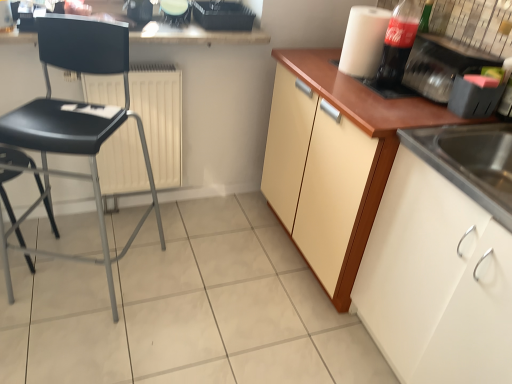
Question: Is smooth white countertop at upper center with white matte radiator at center?

Choices:
 (A) no
 (B) yes

Answer: (A)

Question: Would you consider smooth white countertop at upper center to be distant from white matte radiator at center?

Choices:
 (A) no
 (B) yes

Answer: (A)

Question: Is smooth white countertop at upper center looking in the opposite direction of white matte radiator at center?

Choices:
 (A) yes
 (B) no

Answer: (B)

Question: Does smooth white countertop at upper center contain white matte radiator at center?

Choices:
 (A) no
 (B) yes

Answer: (A)

Question: Can you confirm if smooth white countertop at upper center is smaller than white matte radiator at center?

Choices:
 (A) no
 (B) yes

Answer: (A)

Question: Considering the positions of white matte radiator at center and white matte paper towel at upper right in the image, is white matte radiator at center taller or shorter than white matte paper towel at upper right?

Choices:
 (A) short
 (B) tall

Answer: (B)

Question: Is white matte radiator at center to the left or to the right of white matte paper towel at upper right in the image?

Choices:
 (A) right
 (B) left

Answer: (B)

Question: Is point (165, 74) positioned closer to the camera than point (379, 23)?

Choices:
 (A) closer
 (B) farther

Answer: (B)

Question: Is white matte radiator at center situated inside white matte paper towel at upper right or outside?

Choices:
 (A) inside
 (B) outside

Answer: (B)

Question: From the image's perspective, is white matte radiator at center positioned above or below black plastic chair at left, the 2th chair when ordered from right to left?

Choices:
 (A) above
 (B) below

Answer: (A)

Question: Is white matte radiator at center wider or thinner than black plastic chair at left, the 2th chair when ordered from right to left?

Choices:
 (A) wide
 (B) thin

Answer: (B)

Question: From a real-world perspective, is white matte radiator at center above or below black plastic chair at left, the 2th chair when ordered from right to left?

Choices:
 (A) above
 (B) below

Answer: (A)

Question: From their relative heights in the image, would you say white matte radiator at center is taller or shorter than black plastic chair at left, the 2th chair when ordered from right to left?

Choices:
 (A) tall
 (B) short

Answer: (A)

Question: From a real-world perspective, is white matte cabinet at lower right, arranged as the 2th cabinetry when viewed from the back, physically located above or below white matte paper towel at upper right?

Choices:
 (A) below
 (B) above

Answer: (A)

Question: In terms of size, does white matte cabinet at lower right, which appears as the first cabinetry when viewed from the front, appear bigger or smaller than white matte paper towel at upper right?

Choices:
 (A) small
 (B) big

Answer: (B)